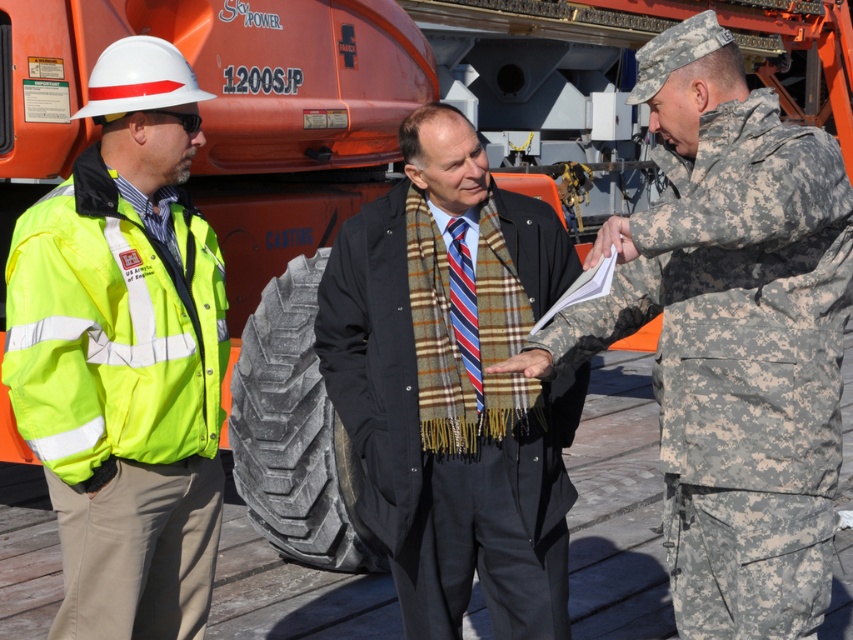
Question: Which point appears farthest from the camera in this image?

Choices:
 (A) (692, 228)
 (B) (422, 282)

Answer: (B)

Question: Which point is farther from the camera taking this photo?

Choices:
 (A) (332, 403)
 (B) (466, 314)
 (C) (154, 320)
 (D) (445, 337)

Answer: (A)

Question: Which object is the closest to the neon yellow reflective safety vest at center?

Choices:
 (A) plaid scarf at center
 (B) high-visibility fabric jacket at left
 (C) camouflage uniform at center
 (D) striped fabric tie at center

Answer: (D)

Question: Does plaid scarf at center have a greater width compared to high-visibility fabric jacket at left?

Choices:
 (A) no
 (B) yes

Answer: (B)

Question: Observing the image, what is the correct spatial positioning of plaid scarf at center in reference to striped fabric tie at center?

Choices:
 (A) below
 (B) above

Answer: (A)

Question: Does camouflage uniform at center come behind high-visibility fabric jacket at left?

Choices:
 (A) yes
 (B) no

Answer: (B)